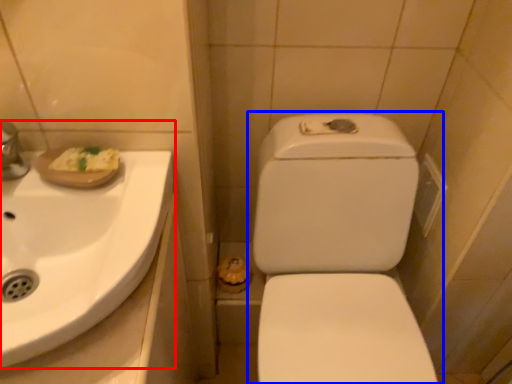
Question: Which point is closer to the camera, sink (highlighted by a red box) or toilet (highlighted by a blue box)?

Choices:
 (A) sink
 (B) toilet

Answer: (A)